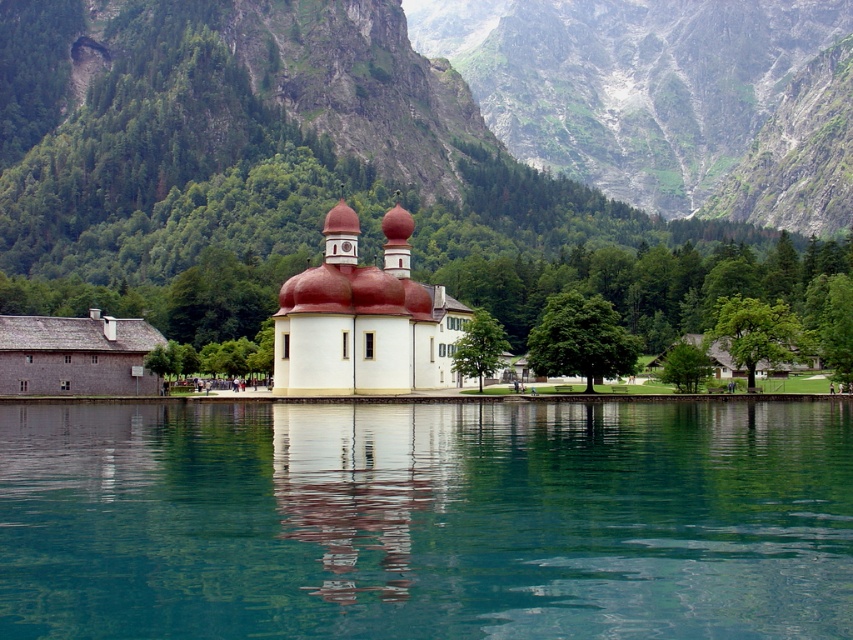
Question: Which of the following is the farthest from the observer?

Choices:
 (A) (138, 531)
 (B) (329, 282)

Answer: (B)

Question: Does clear glass water at center have a greater width compared to white matte chapel at center?

Choices:
 (A) no
 (B) yes

Answer: (B)

Question: In this image, where is clear glass water at center located relative to white matte chapel at center?

Choices:
 (A) right
 (B) left

Answer: (A)

Question: In this image, where is clear glass water at center located relative to white matte chapel at center?

Choices:
 (A) right
 (B) left

Answer: (A)